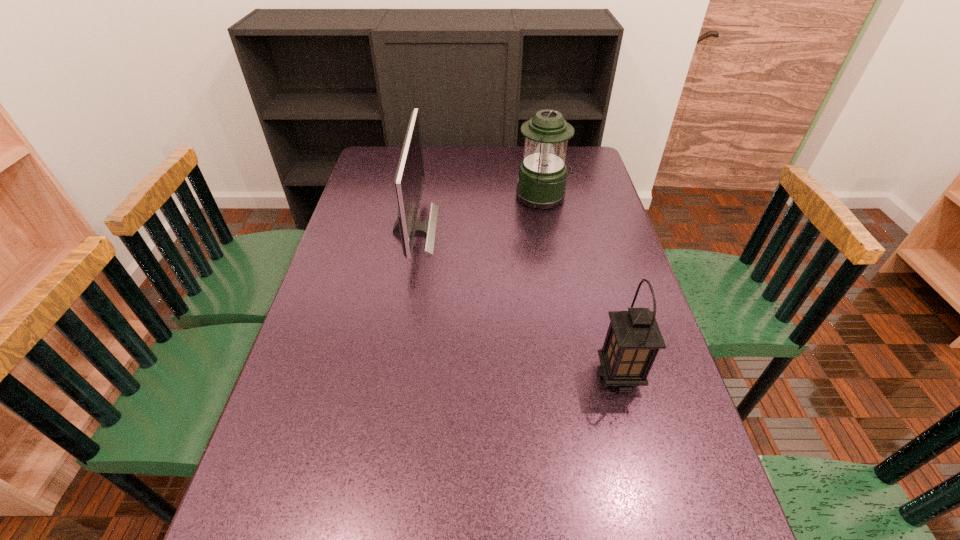
Where is `the leftmost object`? Image resolution: width=960 pixels, height=540 pixels. the leftmost object is located at coordinates tap(409, 180).

You are a GUI agent. You are given a task and a screenshot of the screen. Output one action in this format:
    pyautogui.click(x=<x>, y=<y>)
    Task: Click on the farther lantern
    The image size is (960, 540).
    Given the screenshot: What is the action you would take?
    pyautogui.click(x=542, y=175)

I want to click on the nearer lantern, so click(633, 339).

Identify the location of vacant space positioned on the screen side of the monitor. (490, 230).

The height and width of the screenshot is (540, 960). In order to click on free spot located 0.130m on the left of the farther lantern in this screenshot , I will do tap(478, 197).

Locate an element on the screen. The width and height of the screenshot is (960, 540). vacant area located 0.340m on the left of the nearer lantern is located at coordinates (447, 376).

Locate an element on the screen. blank space at the far edge of the desktop is located at coordinates (510, 167).

In order to click on vacant space at the left edge of the desktop in this screenshot , I will do `click(307, 408)`.

In the image, there is a desktop. What are the coordinates of `free space at the far left corner` in the screenshot? It's located at (384, 168).

The width and height of the screenshot is (960, 540). Identify the location of free space at the far right corner of the desktop. (593, 157).